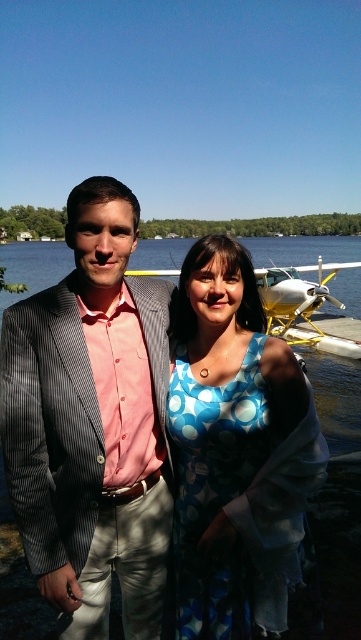
Between matte pink shirt at center and clear water at center, which one has less height?

Standing shorter between the two is matte pink shirt at center.

Based on the photo, can you confirm if matte pink shirt at center is shorter than clear water at center?

Yes, matte pink shirt at center is shorter than clear water at center.

Where is `matte pink shirt at center`? The image size is (361, 640). matte pink shirt at center is located at coordinates (92, 422).

Locate an element on the screen. matte pink shirt at center is located at coordinates (92, 422).

Measure the distance between matte pink shirt at center and blue dotted dress at center.

matte pink shirt at center is 18.11 inches from blue dotted dress at center.

Does point (79, 492) come in front of point (324, 456)?

Yes, point (79, 492) is closer to viewer.

Where is `matte pink shirt at center`? This screenshot has height=640, width=361. matte pink shirt at center is located at coordinates (92, 422).

Does blue dotted dress at center have a lesser height compared to clear water at center?

Correct, blue dotted dress at center is not as tall as clear water at center.

Is point (248, 518) positioned before point (288, 316)?

Yes.

Which is behind, point (198, 554) or point (301, 256)?

Positioned behind is point (301, 256).

Identify the location of blue dotted dress at center. The image size is (361, 640). (236, 451).